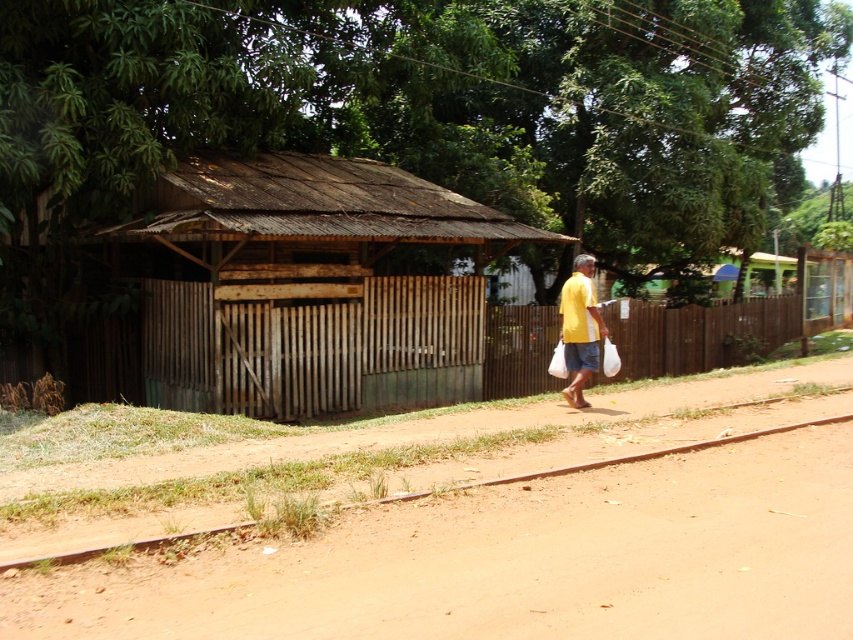
You are standing at the entrance of the rustic structure and want to follow the person in the yellow matte shirt at center. Which direction should you go relative to the brown dirt track at lower left?

The brown dirt track at lower left is in front of the yellow matte shirt at center, so you should go in the direction of the brown dirt track at lower left to follow the person.

You are standing at the point with coordinates point (505, 381) and want to walk to the point with coordinates point (634, 429). Which direction should you move relative to the structure?

You should move forward relative to the structure because point (634, 429) is in front of point (505, 381).